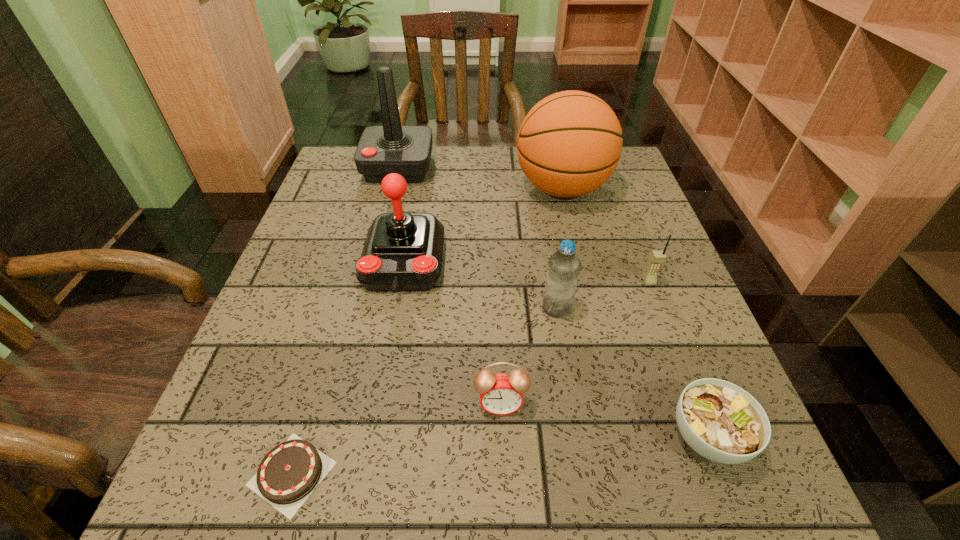
At what (x,y) coordinates should I click in order to perform the action: click on object present at the near right corner. Please return your answer as a coordinate pair (x, y). This screenshot has width=960, height=540. Looking at the image, I should click on (722, 422).

Locate an element on the screen. blank space at the far edge is located at coordinates (514, 160).

In the image, there is a desktop. Where is `vacant space at the near edge`? This screenshot has height=540, width=960. vacant space at the near edge is located at coordinates (465, 485).

In the image, there is a desktop. Where is `vacant space at the left edge`? vacant space at the left edge is located at coordinates (343, 323).

You are a GUI agent. You are given a task and a screenshot of the screen. Output one action in this format:
    pyautogui.click(x=<x>, y=<y>)
    Task: Click on the vacant area at the right edge
    The width and height of the screenshot is (960, 540).
    Given the screenshot: What is the action you would take?
    pyautogui.click(x=650, y=252)

I want to click on vacant space at the near left corner of the desktop, so click(x=236, y=468).

This screenshot has height=540, width=960. What are the coordinates of `vacant region at the near right corner of the desktop` in the screenshot? It's located at (715, 504).

Image resolution: width=960 pixels, height=540 pixels. In order to click on free space between the soup bowl and the fourth tallest object in this screenshot , I will do click(633, 372).

The image size is (960, 540). Identify the location of empty location between the nearer joystick and the water bottle. (480, 285).

Locate an element on the screen. Image resolution: width=960 pixels, height=540 pixels. free space between the basketball and the sixth tallest object is located at coordinates (531, 296).